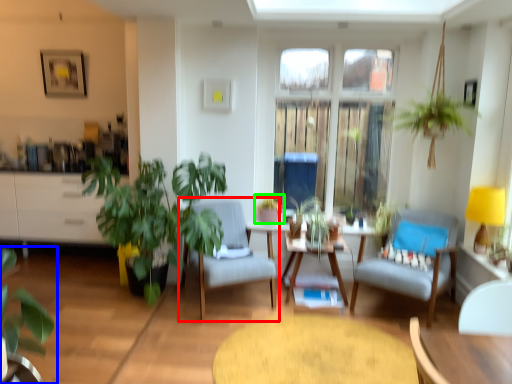
Question: Considering the real-world distances, which object is farthest from chair (highlighted by a red box)? houseplant (highlighted by a blue box) or houseplant (highlighted by a green box)?

Choices:
 (A) houseplant
 (B) houseplant

Answer: (A)